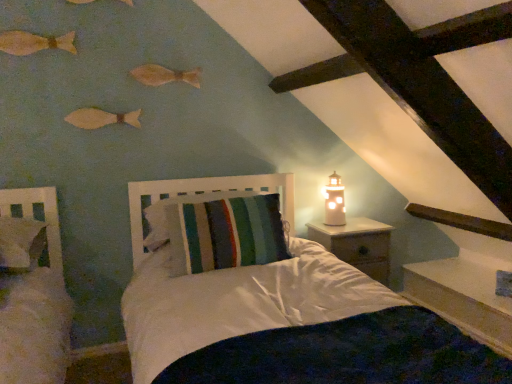
Question: Would you say wooden fish at upper left, marked as the first fish in a top-to-bottom arrangement, is part of wooden fish at upper left, marked as the second fish in a top-to-bottom arrangement,'s contents?

Choices:
 (A) yes
 (B) no

Answer: (B)

Question: From the image's perspective, is wooden fish at upper left, which ranks as the 3th fish in bottom-to-top order, located beneath wooden fish at upper left, the 4th fish positioned from the bottom?

Choices:
 (A) yes
 (B) no

Answer: (A)

Question: Does wooden fish at upper left, marked as the second fish in a top-to-bottom arrangement, appear on the right side of wooden fish at upper left, the 4th fish positioned from the bottom?

Choices:
 (A) no
 (B) yes

Answer: (A)

Question: Can you see wooden fish at upper left, which ranks as the 3th fish in bottom-to-top order, touching wooden fish at upper left, marked as the first fish in a top-to-bottom arrangement?

Choices:
 (A) yes
 (B) no

Answer: (B)

Question: Would you say wooden fish at upper left, marked as the second fish in a top-to-bottom arrangement, is outside wooden fish at upper left, the 4th fish positioned from the bottom?

Choices:
 (A) yes
 (B) no

Answer: (A)

Question: From a real-world perspective, is wooden fish at upper left, marked as the second fish in a top-to-bottom arrangement, beneath wooden fish at upper left, marked as the first fish in a top-to-bottom arrangement?

Choices:
 (A) no
 (B) yes

Answer: (B)

Question: Considering the relative sizes of wooden fish at upper center, placed as the third fish when sorted from top to bottom, and matte wooden fish at upper left, placed as the fourth fish when sorted from top to bottom, in the image provided, is wooden fish at upper center, placed as the third fish when sorted from top to bottom, wider than matte wooden fish at upper left, placed as the fourth fish when sorted from top to bottom,?

Choices:
 (A) no
 (B) yes

Answer: (B)

Question: Considering the relative positions of wooden fish at upper center, placed as the third fish when sorted from top to bottom, and matte wooden fish at upper left, placed as the fourth fish when sorted from top to bottom, in the image provided, is wooden fish at upper center, placed as the third fish when sorted from top to bottom, in front of matte wooden fish at upper left, placed as the fourth fish when sorted from top to bottom,?

Choices:
 (A) yes
 (B) no

Answer: (B)

Question: From a real-world perspective, is wooden fish at upper center, placed as the third fish when sorted from top to bottom, positioned under matte wooden fish at upper left, which ranks as the first fish in bottom-to-top order, based on gravity?

Choices:
 (A) yes
 (B) no

Answer: (B)

Question: Is wooden fish at upper center, the 2th fish when ordered from bottom to top, outside of matte wooden fish at upper left, which ranks as the first fish in bottom-to-top order?

Choices:
 (A) yes
 (B) no

Answer: (A)

Question: Is matte wooden fish at upper left, which ranks as the first fish in bottom-to-top order, a part of wooden fish at upper center, placed as the third fish when sorted from top to bottom?

Choices:
 (A) no
 (B) yes

Answer: (A)

Question: Is wooden fish at upper center, the 2th fish when ordered from bottom to top, shorter than matte wooden fish at upper left, placed as the fourth fish when sorted from top to bottom?

Choices:
 (A) yes
 (B) no

Answer: (B)

Question: Does wooden fish at upper left, the 4th fish positioned from the bottom, have a lesser height compared to wooden nightstand at right?

Choices:
 (A) yes
 (B) no

Answer: (A)